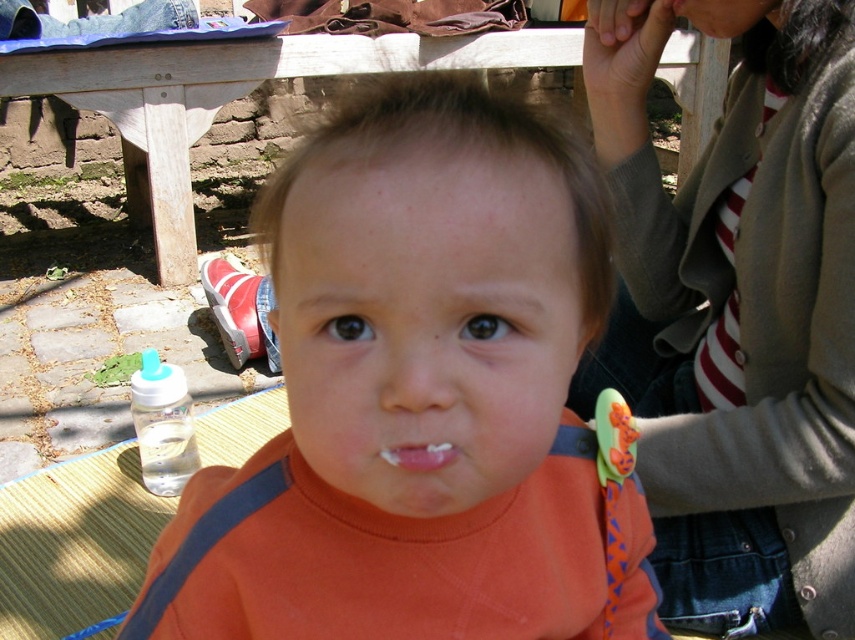
Question: Does orange fabric bib at center appear on the left side of pink glossy lips at center?

Choices:
 (A) no
 (B) yes

Answer: (A)

Question: Which point is farther from the camera taking this photo?

Choices:
 (A) (172, 138)
 (B) (727, 22)
 (C) (511, 611)

Answer: (A)

Question: Which object is the closest to the orange fabric bib at center?

Choices:
 (A) striped fabric tie at upper right
 (B) wooden picnic table at center
 (C) pink glossy lips at center
 (D) clear plastic bottle at lower left

Answer: (C)

Question: Can you confirm if striped fabric tie at upper right is positioned below clear plastic bottle at lower left?

Choices:
 (A) no
 (B) yes

Answer: (A)

Question: Considering the real-world distances, which object is farthest from the orange fabric bib at center?

Choices:
 (A) striped fabric tie at upper right
 (B) wooden picnic table at center

Answer: (B)

Question: Does wooden picnic table at center lie in front of clear plastic bottle at lower left?

Choices:
 (A) no
 (B) yes

Answer: (A)